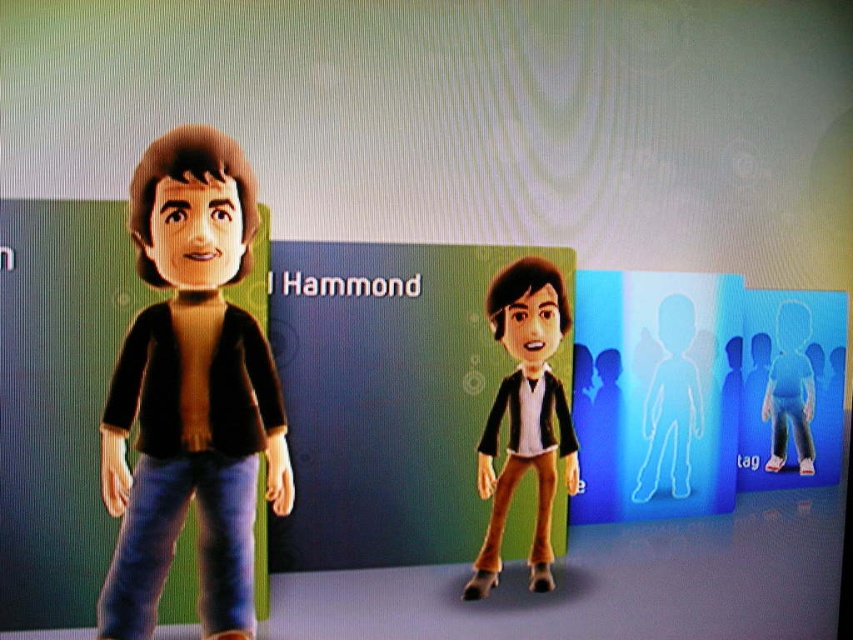
In the character customization screen, there is a point labeled at coordinates (190,392). Which part of the character does this point correspond to?

The point at coordinates (190,392) corresponds to the matte black jacket at left.

You are a game developer checking the customization screen. You see the matte black jacket at left and the transparent plastic figure at center. Which object is positioned higher on the screen?

The matte black jacket at left is located above the transparent plastic figure at center, so it is positioned higher on the screen.

You are trying to decide between two customization options for your character. You have a matte black jacket at left and a transparent blue figure at center. Which option takes up more horizontal space?

The matte black jacket at left is wider than the transparent blue figure at center, so it takes up more horizontal space.